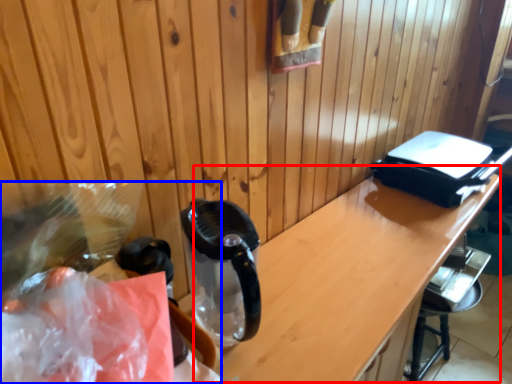
Question: Which of the following is the farthest to the observer, table (highlighted by a red box) or waste (highlighted by a blue box)?

Choices:
 (A) table
 (B) waste

Answer: (A)